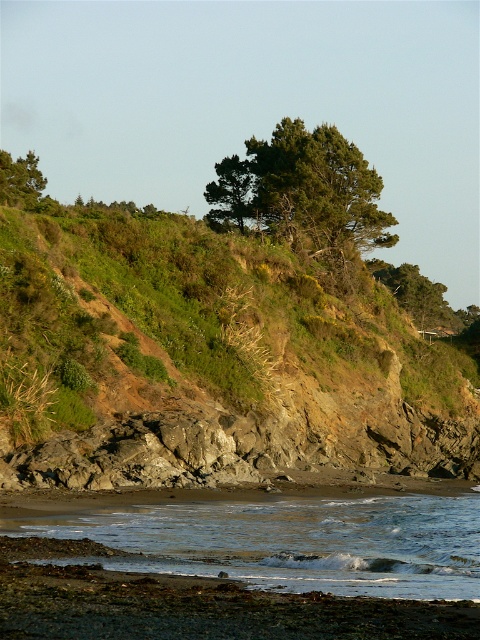
Question: Can you confirm if green grassy hillside at upper center is smaller than green leafy tree at upper left?

Choices:
 (A) yes
 (B) no

Answer: (A)

Question: Can you confirm if green grassy hillside at upper center is wider than green leafy tree at upper center?

Choices:
 (A) no
 (B) yes

Answer: (B)

Question: Which object is the farthest from the green leafy tree at upper left?

Choices:
 (A) green leafy tree at upper center
 (B) green grassy hillside at upper center

Answer: (B)

Question: Among these objects, which one is nearest to the camera?

Choices:
 (A) clear water at lower center
 (B) green leafy tree at upper center

Answer: (A)

Question: Is green grassy hillside at upper center positioned behind clear water at lower center?

Choices:
 (A) no
 (B) yes

Answer: (B)

Question: Estimate the real-world distances between objects in this image. Which object is closer to the clear water at lower center?

Choices:
 (A) green grassy hillside at upper center
 (B) green leafy tree at upper left

Answer: (A)